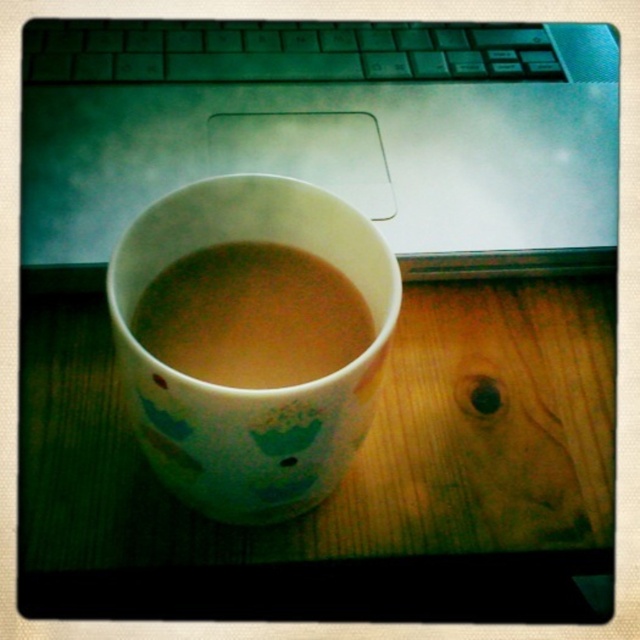
Question: Which point is farther to the camera?

Choices:
 (A) sleek silver laptop at upper center
 (B) white glossy mug at center

Answer: (A)

Question: Which object appears closest to the camera in this image?

Choices:
 (A) black plastic keyboard at upper center
 (B) white glossy mug at center

Answer: (B)

Question: Which of these objects is positioned closest to the brown matte cup at center?

Choices:
 (A) sleek silver laptop at upper center
 (B) black plastic keyboard at upper center

Answer: (A)

Question: Does black plastic keyboard at upper center have a greater width compared to brown matte cup at center?

Choices:
 (A) no
 (B) yes

Answer: (B)

Question: Can you confirm if white glossy mug at center is positioned above brown matte cup at center?

Choices:
 (A) no
 (B) yes

Answer: (A)

Question: From the image, what is the correct spatial relationship of white matte wood table at center in relation to black plastic keyboard at upper center?

Choices:
 (A) left
 (B) right

Answer: (B)